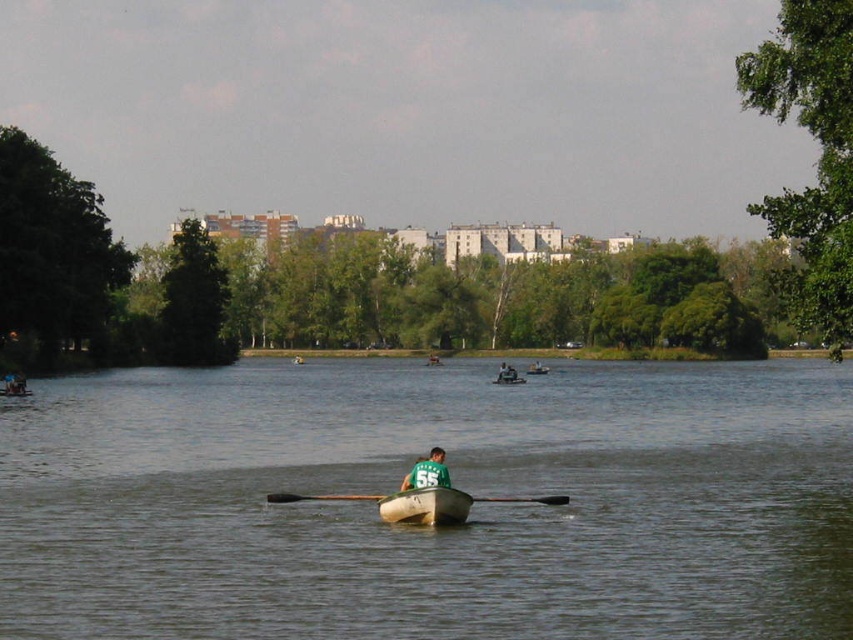
Question: Does brown wooden boat at center appear on the left side of green fabric shirt at center?

Choices:
 (A) yes
 (B) no

Answer: (A)

Question: Which point is closer to the camera?

Choices:
 (A) (511, 378)
 (B) (407, 483)
 (C) (515, 380)
 (D) (358, 493)

Answer: (B)

Question: Which is farther from the green fabric shirt at center?

Choices:
 (A) brown wooden boat at center
 (B) green jersey at center

Answer: (B)

Question: Which object is the closest to the wooden smooth paddle at center?

Choices:
 (A) white plastic canoe at center
 (B) brown wooden boat at center
 (C) green jersey at center
 (D) green fabric shirt at center

Answer: (C)

Question: Can you confirm if green fabric shirt at center is wider than white plastic canoe at center?

Choices:
 (A) no
 (B) yes

Answer: (B)

Question: Is brown wooden boat at center wider than green fabric shirt at center?

Choices:
 (A) yes
 (B) no

Answer: (A)